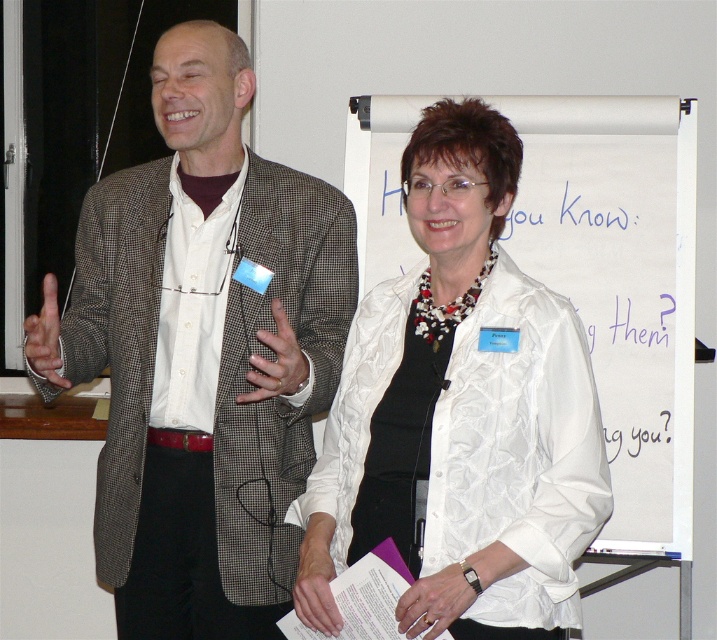
Question: Can you confirm if white fabric at upper center is wider than matte black hand at left?

Choices:
 (A) no
 (B) yes

Answer: (B)

Question: Which point appears farthest from the camera in this image?

Choices:
 (A) (417, 586)
 (B) (33, 317)
 (C) (137, 467)
 (D) (394, 154)

Answer: (D)

Question: Can you confirm if white fabric at center is bigger than matte black hand at left?

Choices:
 (A) yes
 (B) no

Answer: (B)

Question: Which point is closer to the camera taking this photo?

Choices:
 (A) (143, 204)
 (B) (543, 108)
 (C) (28, 348)
 (D) (508, 292)

Answer: (C)

Question: Is white satin lab coat at center bigger than matte black hand at left?

Choices:
 (A) no
 (B) yes

Answer: (B)

Question: Which point is closer to the camera?

Choices:
 (A) white fabric at center
 (B) white fabric at upper center

Answer: (A)